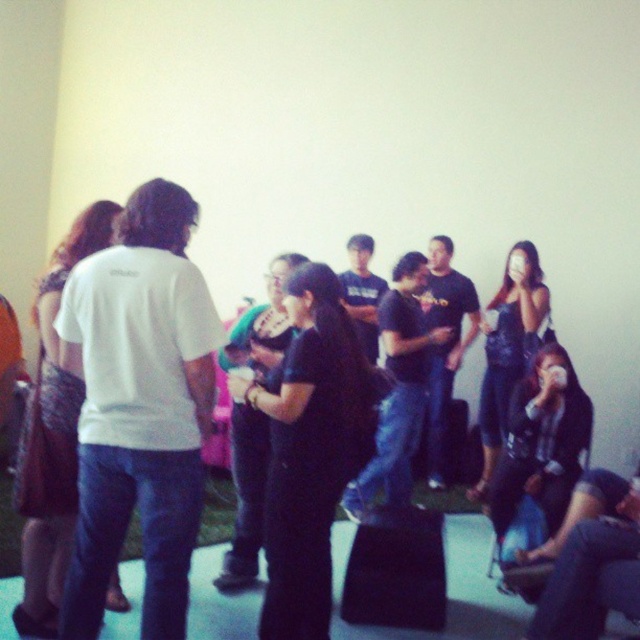
You are at a social gathering and want to find the exact location of the point with coordinates (x=140, y=406). Which object in the scene is this point located on?

The point with coordinates (x=140, y=406) is located on the white matte t shirt at left.